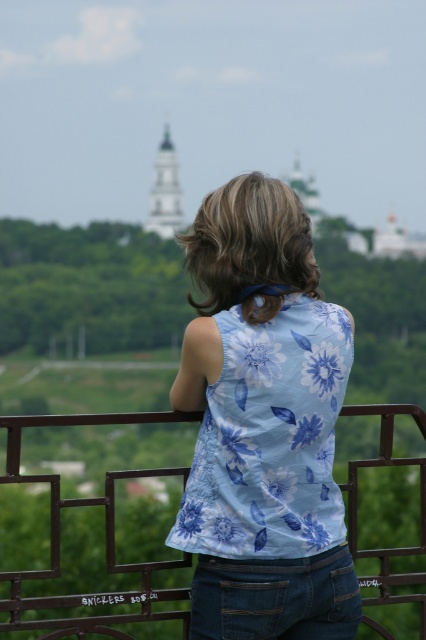
Does metallic brown railing at center have a lesser height compared to denim at center?

Incorrect, metallic brown railing at center's height does not fall short of denim at center's.

Is point (414, 577) closer to viewer compared to point (298, 557)?

No, (414, 577) is behind (298, 557).

Which is in front, point (420, 472) or point (244, 602)?

Positioned in front is point (244, 602).

Find the location of a particular element. Image resolution: width=426 pixels, height=640 pixels. metallic brown railing at center is located at coordinates (104, 534).

Identify the location of light blue floral tank top at center. Image resolution: width=426 pixels, height=640 pixels. (262, 424).

Does light blue floral tank top at center appear on the left side of metallic brown railing at center?

Incorrect, light blue floral tank top at center is not on the left side of metallic brown railing at center.

Is point (281, 342) farther from viewer compared to point (359, 404)?

No, it is not.

At what (x,y) coordinates should I click in order to perform the action: click on light blue floral tank top at center. Please return your answer as a coordinate pair (x, y). Looking at the image, I should click on (262, 424).

Does point (296, 589) come closer to viewer compared to point (160, 230)?

Yes.

Looking at this image, which is above, denim at center or white steeple at upper center?

white steeple at upper center

This screenshot has height=640, width=426. I want to click on denim at center, so click(276, 596).